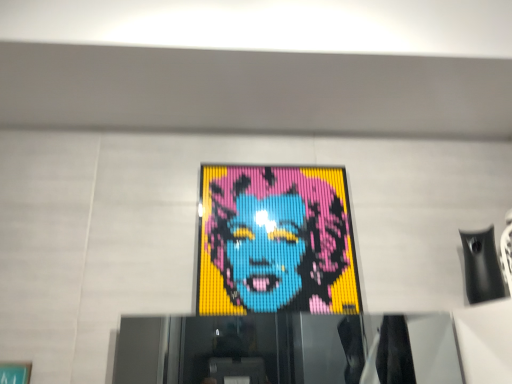
The width and height of the screenshot is (512, 384). Identify the location of pixelated mosaic portrait at center. (276, 241).

What do you see at coordinates (276, 241) in the screenshot? This screenshot has height=384, width=512. I see `pixelated mosaic portrait at center` at bounding box center [276, 241].

The image size is (512, 384). Identify the location of pixelated mosaic portrait at center. (276, 241).